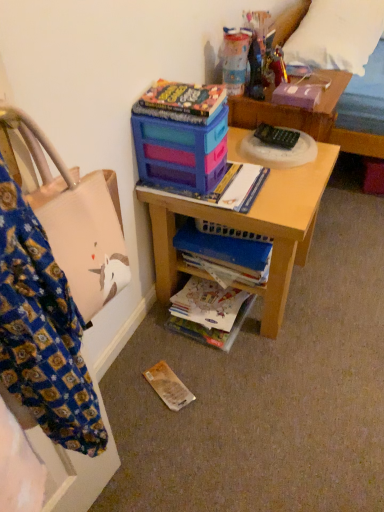
Question: Does matte plastic toy box at upper center have a greater width compared to white soft pillow at upper right?

Choices:
 (A) yes
 (B) no

Answer: (B)

Question: Is matte plastic toy box at upper center positioned far away from white soft pillow at upper right?

Choices:
 (A) yes
 (B) no

Answer: (A)

Question: Is matte plastic toy box at upper center with white soft pillow at upper right?

Choices:
 (A) no
 (B) yes

Answer: (A)

Question: Does matte plastic toy box at upper center have a lesser width compared to white soft pillow at upper right?

Choices:
 (A) yes
 (B) no

Answer: (A)

Question: Is matte plastic toy box at upper center facing away from white soft pillow at upper right?

Choices:
 (A) yes
 (B) no

Answer: (B)

Question: In terms of size, does brown paper book at lower center, acting as the second paperback book starting from the back, appear bigger or smaller than black plastic remote control at center?

Choices:
 (A) small
 (B) big

Answer: (A)

Question: Is brown paper book at lower center, the third paperback book positioned from the right, wider or thinner than black plastic remote control at center?

Choices:
 (A) wide
 (B) thin

Answer: (A)

Question: Is point (152, 368) positioned closer to the camera than point (291, 134)?

Choices:
 (A) closer
 (B) farther

Answer: (A)

Question: Choose the correct answer: Is brown paper book at lower center, positioned as the third paperback book in top-to-bottom order, inside black plastic remote control at center or outside it?

Choices:
 (A) outside
 (B) inside

Answer: (A)

Question: Relative to white soft pillow at upper right, is hardcover book at upper center, positioned as the second paperback book in left-to-right order, in front or behind?

Choices:
 (A) front
 (B) behind

Answer: (A)

Question: From the image's perspective, is hardcover book at upper center, which is the 3th paperback book from back to front, positioned above or below white soft pillow at upper right?

Choices:
 (A) above
 (B) below

Answer: (B)

Question: From a real-world perspective, is hardcover book at upper center, which ranks as the 2th paperback book in bottom-to-top order, physically located above or below white soft pillow at upper right?

Choices:
 (A) below
 (B) above

Answer: (B)

Question: Based on their sizes in the image, would you say hardcover book at upper center, the 2th paperback book positioned from the top, is bigger or smaller than white soft pillow at upper right?

Choices:
 (A) small
 (B) big

Answer: (A)

Question: Choose the correct answer: Is matte paper book at lower center, which appears as the first book when ordered from the bottom, inside hardcover book at upper right, which appears as the third paperback book when viewed from the left, or outside it?

Choices:
 (A) outside
 (B) inside

Answer: (A)

Question: In terms of size, does matte paper book at lower center, which is the 2th book from top to bottom, appear bigger or smaller than hardcover book at upper right, positioned as the 3th paperback book in front-to-back order?

Choices:
 (A) big
 (B) small

Answer: (A)